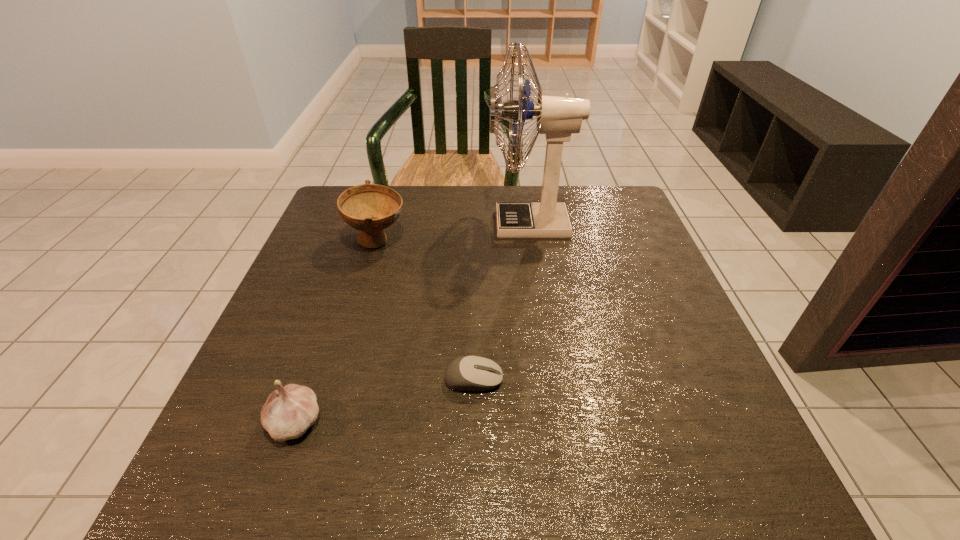
The height and width of the screenshot is (540, 960). I want to click on fan, so click(557, 117).

Where is `the second tallest object`? The height and width of the screenshot is (540, 960). the second tallest object is located at coordinates (370, 208).

Image resolution: width=960 pixels, height=540 pixels. Find the location of `garlic`. garlic is located at coordinates (289, 411).

Locate an element on the screen. the nearest object is located at coordinates (289, 411).

The height and width of the screenshot is (540, 960). In order to click on the shortest object in this screenshot , I will do `click(470, 373)`.

This screenshot has height=540, width=960. What are the coordinates of `computer equipment` in the screenshot? It's located at coord(470,373).

I want to click on vacant space situated 0.110m on the front-facing side of the tallest object, so click(x=446, y=224).

At what (x,y) coordinates should I click in order to perform the action: click on free spot located 0.050m on the front-facing side of the tallest object. Please return your answer as a coordinate pair (x, y). The image size is (960, 540). Looking at the image, I should click on (469, 224).

This screenshot has height=540, width=960. I want to click on free space located 0.200m on the front-facing side of the tallest object, so click(412, 224).

What are the coordinates of `free location located 0.110m on the right of the third shortest object` in the screenshot? It's located at (451, 241).